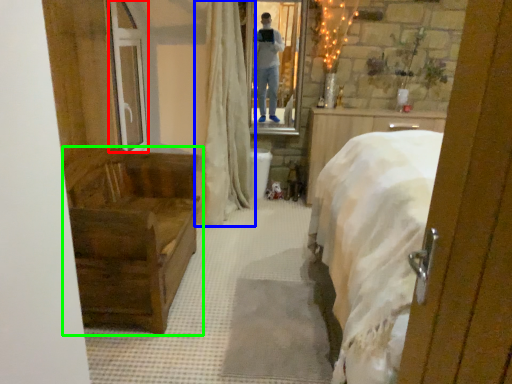
Question: Considering the real-world distances, which object is farthest from glass door (highlighted by a red box)? curtain (highlighted by a blue box) or furniture (highlighted by a green box)?

Choices:
 (A) curtain
 (B) furniture

Answer: (B)